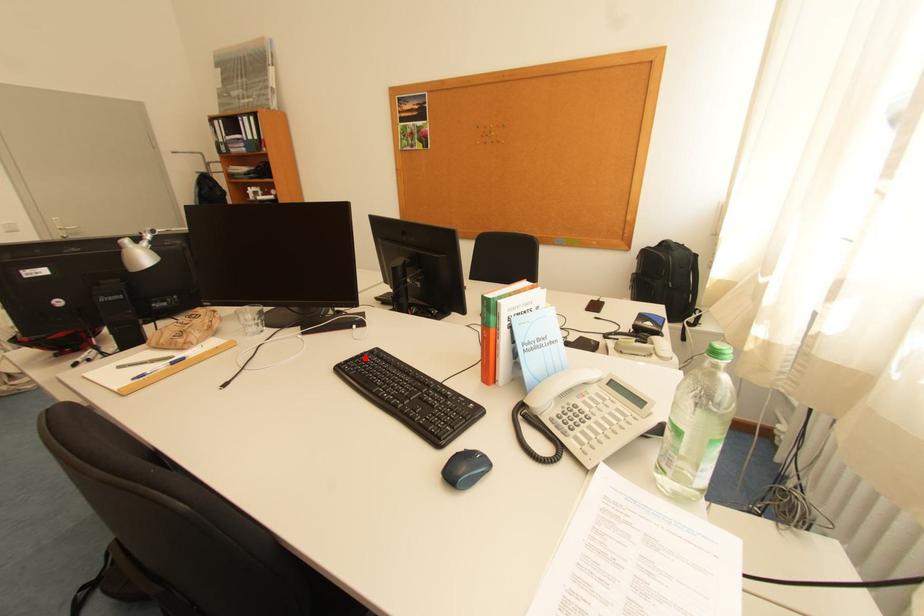
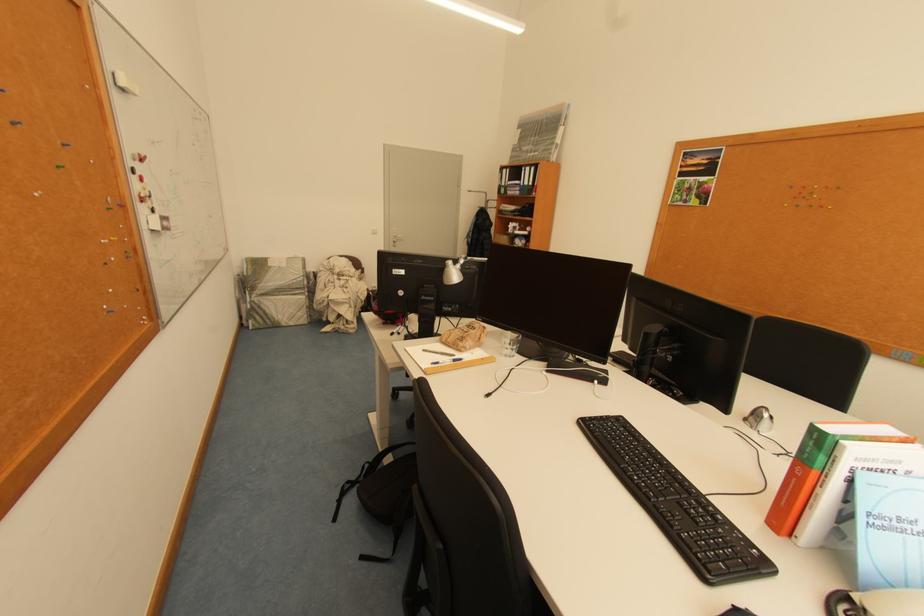
The point at the highlighted location is marked in the first image. Where is the corresponding point in the second image?

(610, 419)